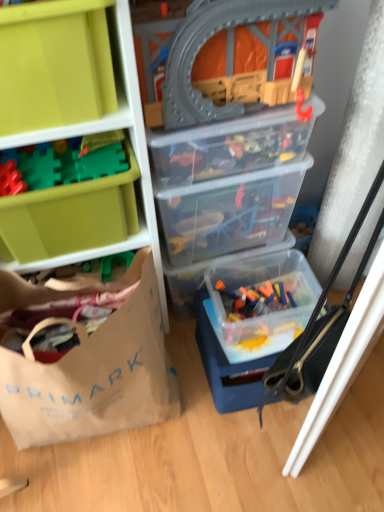
Identify the location of free point in front of translucent plastic container at lower right, the third toy positioned from the left. The height and width of the screenshot is (512, 384). (273, 343).